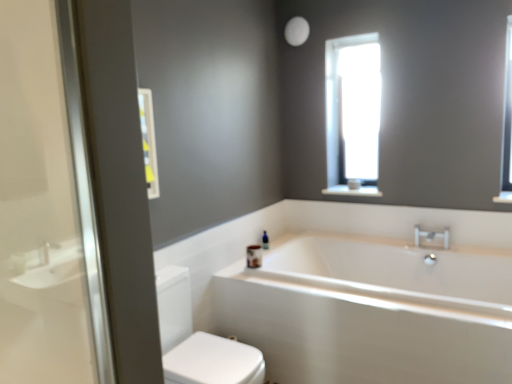
Question: Is white glossy bathtub at center at the back of silver metallic faucet at upper right?

Choices:
 (A) no
 (B) yes

Answer: (A)

Question: Considering the relative sizes of silver metallic faucet at upper right and white glossy bathtub at center in the image provided, is silver metallic faucet at upper right smaller than white glossy bathtub at center?

Choices:
 (A) no
 (B) yes

Answer: (B)

Question: Can you confirm if silver metallic faucet at upper right is thinner than white glossy bathtub at center?

Choices:
 (A) no
 (B) yes

Answer: (B)

Question: From the image's perspective, is silver metallic faucet at upper right above white glossy bathtub at center?

Choices:
 (A) no
 (B) yes

Answer: (B)

Question: Does silver metallic faucet at upper right have a lesser height compared to white glossy bathtub at center?

Choices:
 (A) yes
 (B) no

Answer: (A)

Question: Is point (309, 274) closer or farther from the camera than point (148, 162)?

Choices:
 (A) closer
 (B) farther

Answer: (B)

Question: Is white glossy bathtub at center inside or outside of white glossy medicine cabinet at upper left?

Choices:
 (A) inside
 (B) outside

Answer: (B)

Question: Is white glossy bathtub at center taller or shorter than white glossy medicine cabinet at upper left?

Choices:
 (A) tall
 (B) short

Answer: (A)

Question: From a real-world perspective, relative to white glossy medicine cabinet at upper left, is white glossy bathtub at center vertically above or below?

Choices:
 (A) above
 (B) below

Answer: (B)

Question: From a real-world perspective, relative to silver metallic faucet at upper right, is blue glass bottle at upper center vertically above or below?

Choices:
 (A) above
 (B) below

Answer: (B)

Question: From their relative heights in the image, would you say blue glass bottle at upper center is taller or shorter than silver metallic faucet at upper right?

Choices:
 (A) short
 (B) tall

Answer: (B)

Question: Is blue glass bottle at upper center inside or outside of silver metallic faucet at upper right?

Choices:
 (A) outside
 (B) inside

Answer: (A)

Question: Is blue glass bottle at upper center bigger or smaller than silver metallic faucet at upper right?

Choices:
 (A) small
 (B) big

Answer: (A)

Question: Considering their positions, is white glossy bathtub at center located in front of or behind silver metallic faucet at upper right?

Choices:
 (A) behind
 (B) front

Answer: (B)

Question: Is white glossy bathtub at center spatially inside silver metallic faucet at upper right, or outside of it?

Choices:
 (A) outside
 (B) inside

Answer: (A)